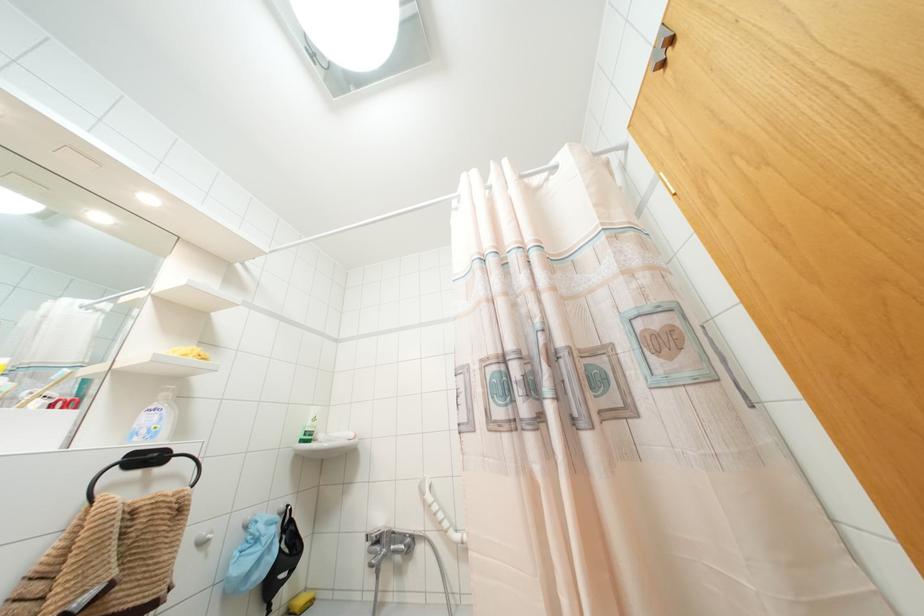
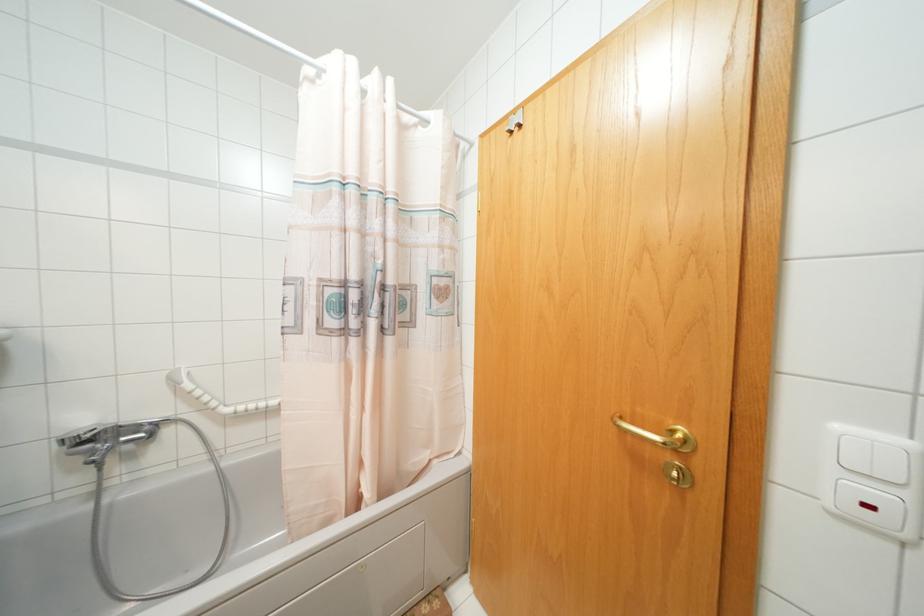
In the second image, find the point that corresponds to (x=663, y=63) in the first image.

(511, 132)